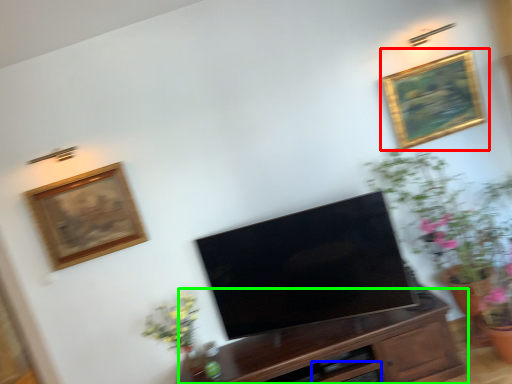
Question: Estimate the real-world distances between objects in this image. Which object is closer to picture frame (highlighted by a red box), drawer (highlighted by a blue box) or cabinetry (highlighted by a green box)?

Choices:
 (A) drawer
 (B) cabinetry

Answer: (B)